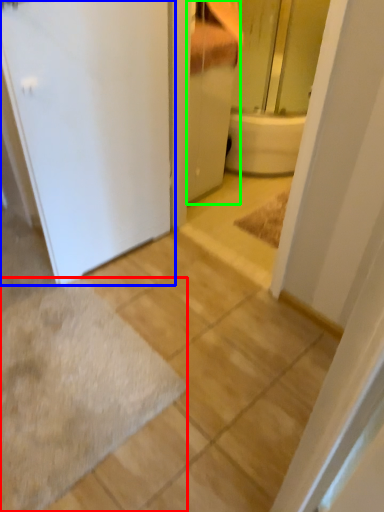
Question: Which object is the closest to the bath mat (highlighted by a red box)? Choose among these: door (highlighted by a blue box) or bathroom cabinet (highlighted by a green box).

Choices:
 (A) door
 (B) bathroom cabinet

Answer: (A)